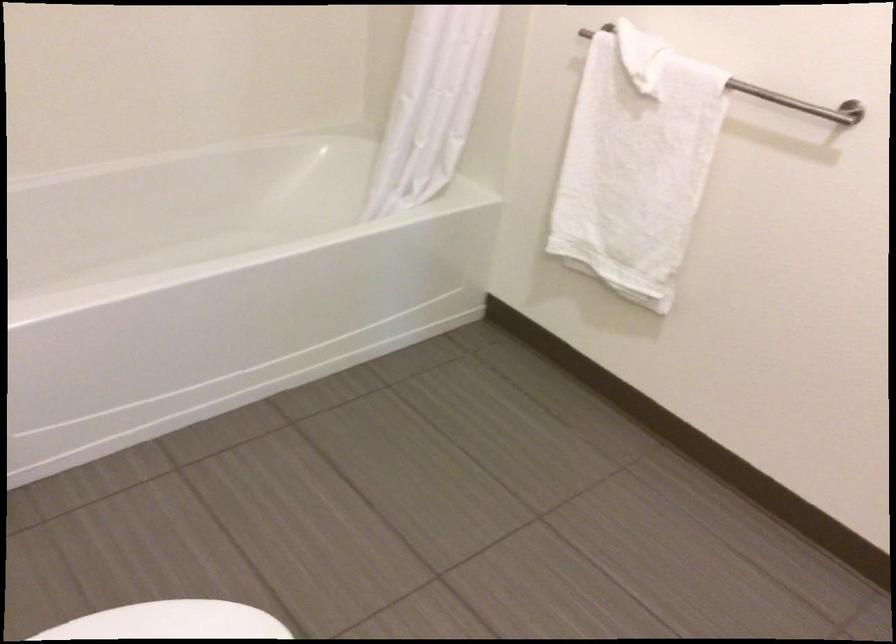
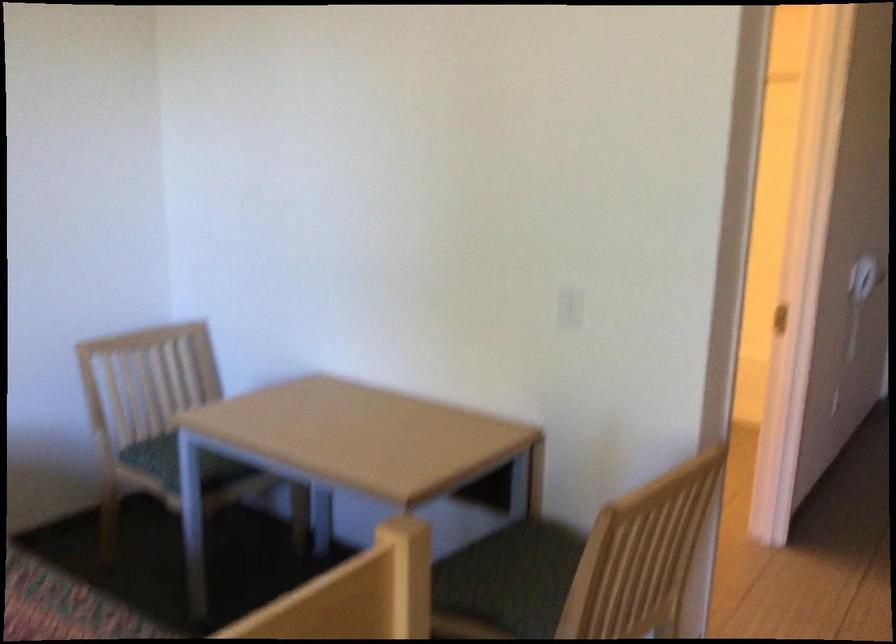
Question: I am providing you with two images of the same scene from different viewpoints. Which of the following objects are not visible in image2?

Choices:
 (A) white toilet lid
 (B) white electrical outlet
 (C) yellow and black box
 (D) chair sitting surface

Answer: (A)